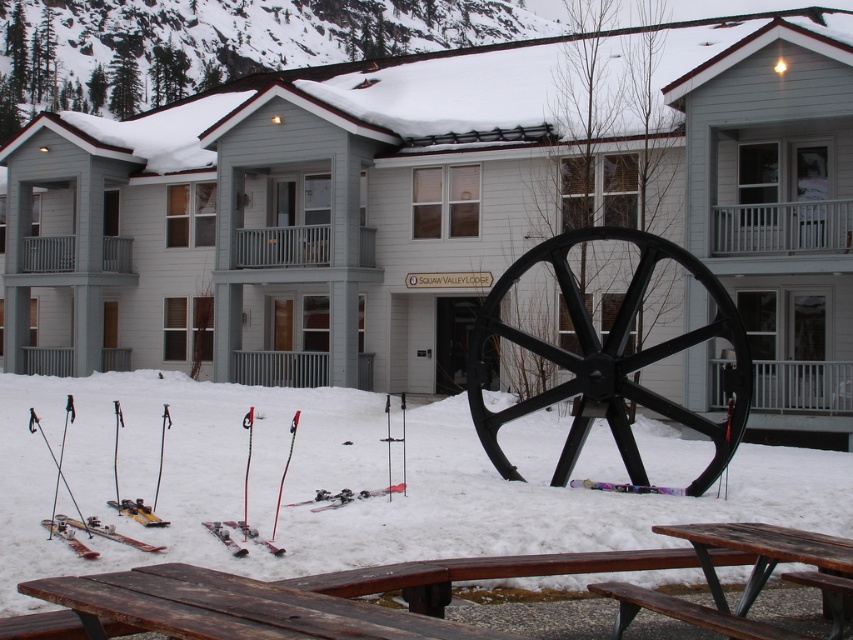
Based on the photo, is dark brown wooden picnic table at lower center shorter than wooden picnic table at lower center?

Correct, dark brown wooden picnic table at lower center is not as tall as wooden picnic table at lower center.

Is dark brown wooden picnic table at lower center wider than wooden picnic table at lower center?

Correct, the width of dark brown wooden picnic table at lower center exceeds that of wooden picnic table at lower center.

The width and height of the screenshot is (853, 640). What do you see at coordinates (229, 609) in the screenshot?
I see `dark brown wooden picnic table at lower center` at bounding box center [229, 609].

In order to click on dark brown wooden picnic table at lower center in this screenshot , I will do `click(229, 609)`.

Who is lower down, matte black skis at lower center or metallic purple ski at lower center?

metallic purple ski at lower center

Who is more distant from viewer, (260, 541) or (628, 492)?

The point (628, 492) is behind.

What are the coordinates of `matte black skis at lower center` in the screenshot? It's located at (242, 536).

Is point (131, 545) positioned after point (160, 520)?

No, (131, 545) is in front of (160, 520).

Does matte black skis at lower left have a larger size compared to metallic skis at lower left?

Actually, matte black skis at lower left might be smaller than metallic skis at lower left.

The width and height of the screenshot is (853, 640). I want to click on matte black skis at lower left, so click(105, 531).